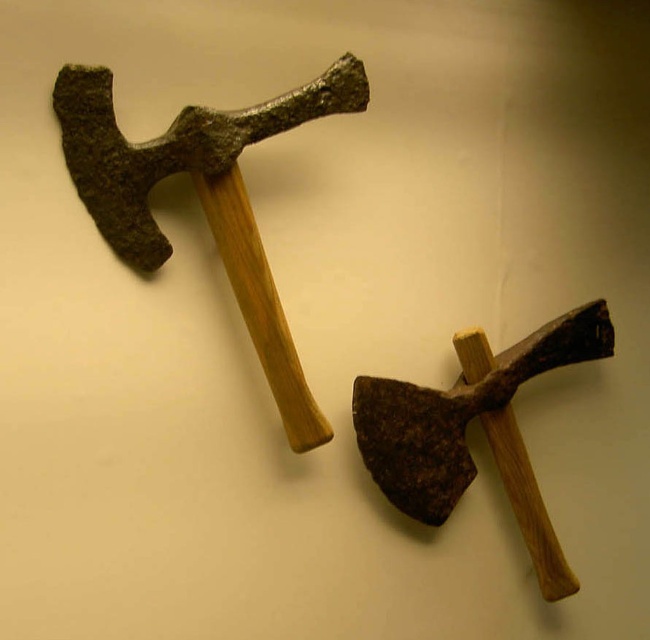
Which of these two, rusty metal hammer at upper left or rusty metal hammer at center, stands taller?

rusty metal hammer at upper left

Who is more distant from viewer, (73,112) or (352,401)?

Positioned behind is point (352,401).

Is point (224, 131) less distant than point (445, 513)?

Yes, point (224, 131) is closer to viewer.

Find the location of a particular element. The height and width of the screenshot is (640, 650). rusty metal hammer at upper left is located at coordinates (202, 198).